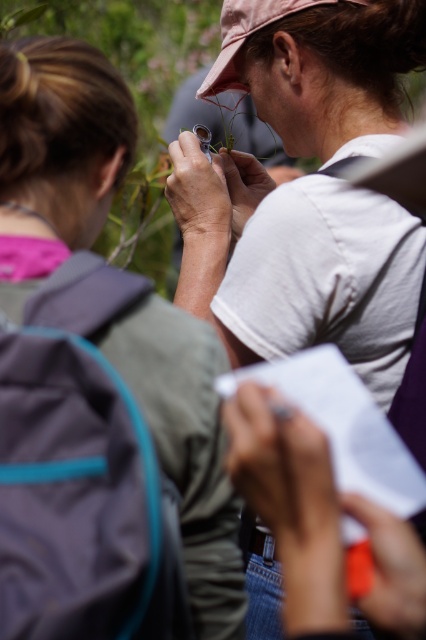
Question: Which point is farther to the camera?

Choices:
 (A) pink fabric baseball cap at upper center
 (B) white matte shirt at center

Answer: (A)

Question: Which of the following is the closest to the observer?

Choices:
 (A) (373, 260)
 (B) (236, 12)

Answer: (A)

Question: Does white matte shirt at center have a larger size compared to pink fabric baseball cap at upper center?

Choices:
 (A) yes
 (B) no

Answer: (A)

Question: From the image, what is the correct spatial relationship of white matte shirt at center in relation to pink fabric baseball cap at upper center?

Choices:
 (A) right
 (B) left

Answer: (A)

Question: Where is white matte shirt at center located in relation to pink fabric baseball cap at upper center in the image?

Choices:
 (A) above
 (B) below

Answer: (B)